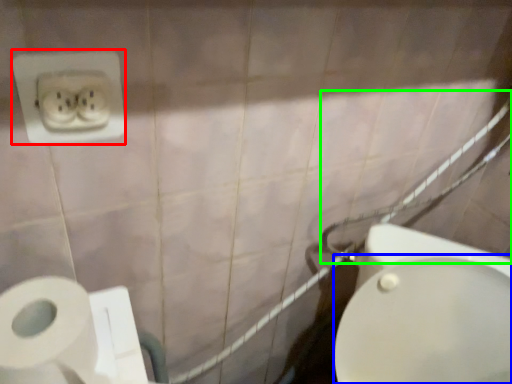
Question: Which is farther away from power plugs and sockets (highlighted by a red box)? bidet (highlighted by a blue box) or shower (highlighted by a green box)?

Choices:
 (A) bidet
 (B) shower

Answer: (B)